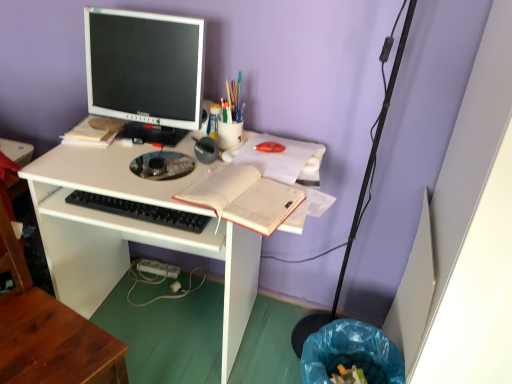
Question: Which direction should I rotate to look at translucent plastic cup at upper center, marked as the first stationery in a back-to-front arrangement, — up or down?

Choices:
 (A) up
 (B) down

Answer: (A)

Question: Is translucent plastic cup at upper center, marked as the first stationery in a back-to-front arrangement, located outside metallic gray pen at center, marked as the third stationery in a back-to-front arrangement?

Choices:
 (A) yes
 (B) no

Answer: (A)

Question: Is translucent plastic cup at upper center, marked as the first stationery in a back-to-front arrangement, to the right of metallic gray pen at center, the 1th stationery from the front, from the viewer's perspective?

Choices:
 (A) yes
 (B) no

Answer: (A)

Question: Considering the relative sizes of translucent plastic cup at upper center, marked as the first stationery in a back-to-front arrangement, and metallic gray pen at center, marked as the third stationery in a back-to-front arrangement, in the image provided, is translucent plastic cup at upper center, marked as the first stationery in a back-to-front arrangement, bigger than metallic gray pen at center, marked as the third stationery in a back-to-front arrangement,?

Choices:
 (A) no
 (B) yes

Answer: (A)

Question: From a real-world perspective, is translucent plastic cup at upper center, which is the third stationery in front-to-back order, beneath metallic gray pen at center, marked as the third stationery in a back-to-front arrangement?

Choices:
 (A) yes
 (B) no

Answer: (B)

Question: Is translucent plastic cup at upper center, marked as the first stationery in a back-to-front arrangement, further to camera compared to metallic gray pen at center, marked as the third stationery in a back-to-front arrangement?

Choices:
 (A) no
 (B) yes

Answer: (B)

Question: Can you confirm if translucent plastic cup at upper center, which is the third stationery in front-to-back order, is smaller than metallic gray pen at center, marked as the third stationery in a back-to-front arrangement?

Choices:
 (A) no
 (B) yes

Answer: (B)

Question: Does black plastic keyboard at center appear on the left side of matte plastic cup at upper center, which appears as the second stationery when viewed from the front?

Choices:
 (A) yes
 (B) no

Answer: (A)

Question: Considering the relative sizes of black plastic keyboard at center and matte plastic cup at upper center, which appears as the second stationery when viewed from the front, in the image provided, is black plastic keyboard at center smaller than matte plastic cup at upper center, which appears as the second stationery when viewed from the front,?

Choices:
 (A) no
 (B) yes

Answer: (A)

Question: From a real-world perspective, does black plastic keyboard at center sit lower than matte plastic cup at upper center, acting as the 2th stationery starting from the back?

Choices:
 (A) no
 (B) yes

Answer: (B)

Question: Is black plastic keyboard at center facing towards matte plastic cup at upper center, acting as the 2th stationery starting from the back?

Choices:
 (A) no
 (B) yes

Answer: (A)

Question: From the image's perspective, is black plastic keyboard at center located beneath matte plastic cup at upper center, which appears as the second stationery when viewed from the front?

Choices:
 (A) no
 (B) yes

Answer: (B)

Question: Is black plastic keyboard at center touching matte plastic cup at upper center, acting as the 2th stationery starting from the back?

Choices:
 (A) no
 (B) yes

Answer: (A)

Question: Does wooden at left have a lesser height compared to translucent plastic cup at upper center, marked as the first stationery in a back-to-front arrangement?

Choices:
 (A) no
 (B) yes

Answer: (A)